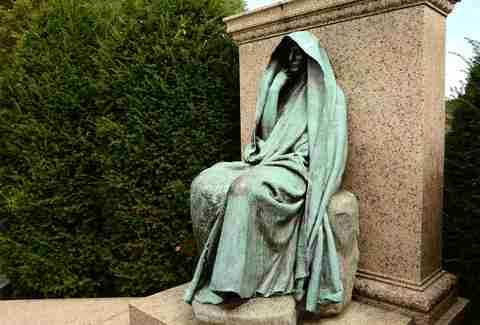
The image size is (480, 325). What are the coordinates of `marble` in the screenshot? It's located at (390, 89).